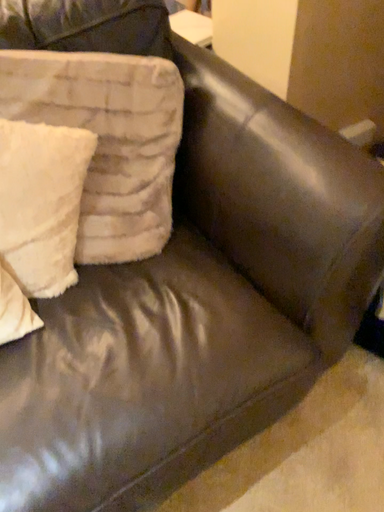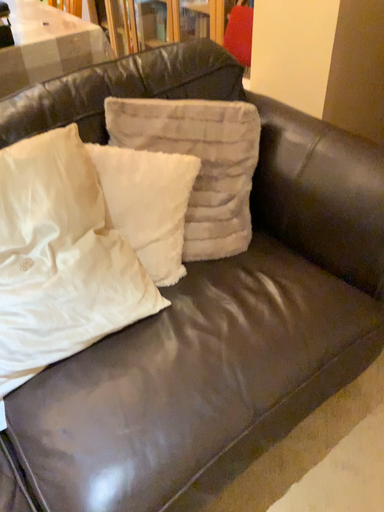
Question: Which way did the camera rotate in the video?

Choices:
 (A) rotated upward
 (B) rotated downward

Answer: (A)